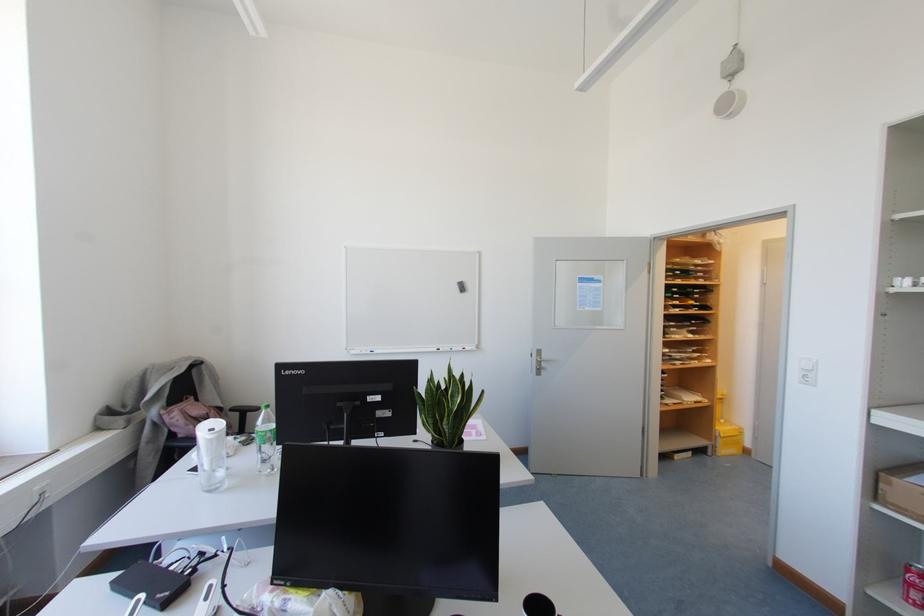
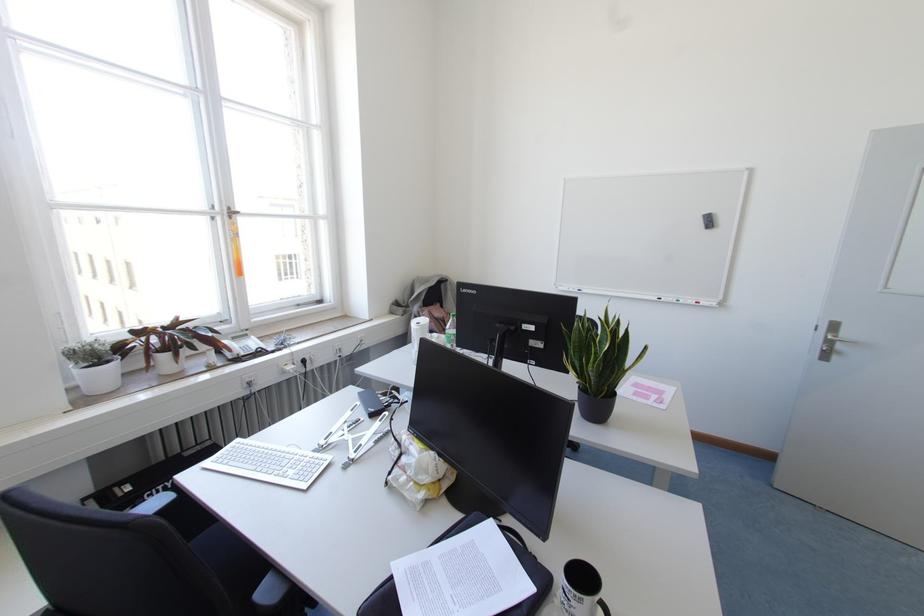
In the second image, find the point that corresponds to (451,397) in the first image.

(599, 342)